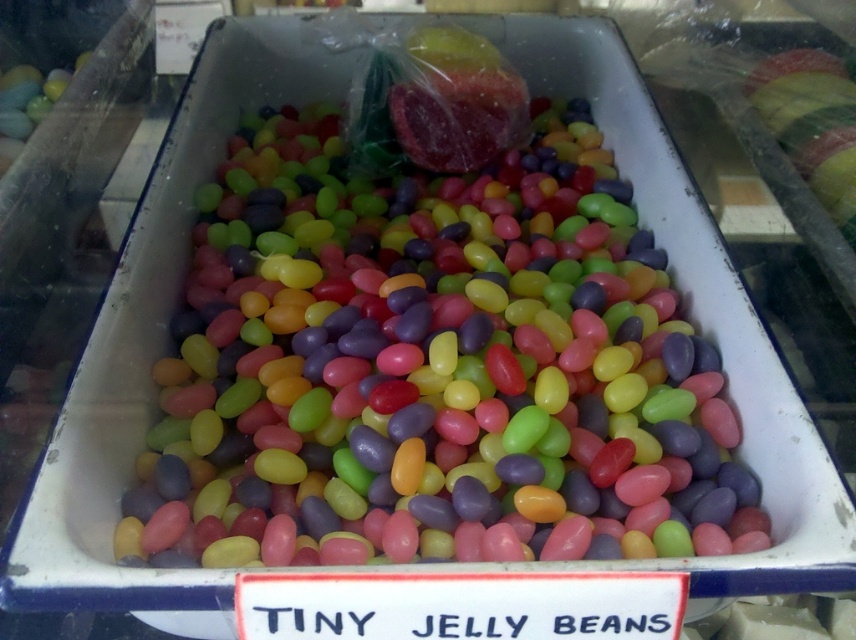
You are a customer at the candy store and want to buy both the shiny metallic apple at upper right and the matte plastic eggs at upper left. The store has a rule that if one item is larger than the other, you must buy the smaller one first. Which item should you purchase first?

The shiny metallic apple at upper right is larger than the matte plastic eggs at upper left, so you should buy the matte plastic eggs at upper left first.

You are a customer trying to choose between buying the glossy jelly beans at center or the shiny metallic apple at upper right. If you want the item that takes up more horizontal space, which one should you choose?

The glossy jelly beans at center might be wider than shiny metallic apple at upper right, so you should choose the glossy jelly beans at center if you want the item that takes up more horizontal space.